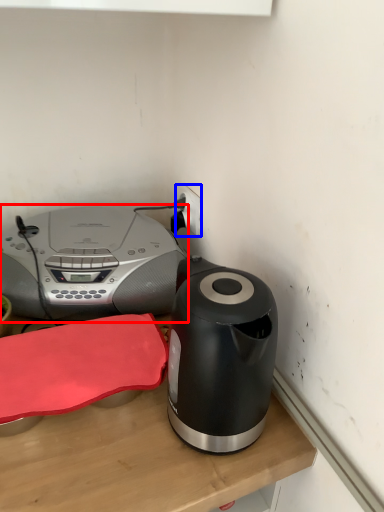
Question: Which of the following is the farthest to the observer, home appliance (highlighted by a red box) or electric outlet (highlighted by a blue box)?

Choices:
 (A) home appliance
 (B) electric outlet

Answer: (B)